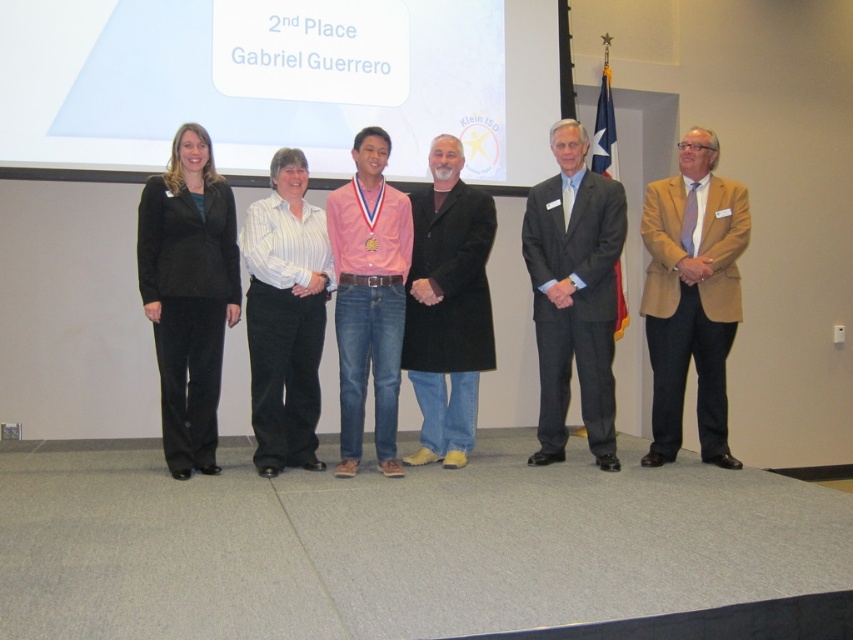
Question: Estimate the real-world distances between objects in this image. Which object is farther from the white striped shirt at center?

Choices:
 (A) pink cotton shirt at center
 (B) black velvet pants at left
 (C) gray suit at center

Answer: (C)

Question: Is tan wool blazer at right positioned before black wool coat at center?

Choices:
 (A) yes
 (B) no

Answer: (A)

Question: Is black wool coat at center to the left of pink cotton shirt at center from the viewer's perspective?

Choices:
 (A) no
 (B) yes

Answer: (A)

Question: Which point is closer to the camera taking this photo?

Choices:
 (A) (193, 230)
 (B) (270, 284)

Answer: (A)

Question: In this image, where is gray suit at center located relative to black wool coat at center?

Choices:
 (A) below
 (B) above

Answer: (B)

Question: Which object appears closest to the camera in this image?

Choices:
 (A) gray suit at center
 (B) tan wool blazer at right
 (C) black velvet pants at left

Answer: (C)